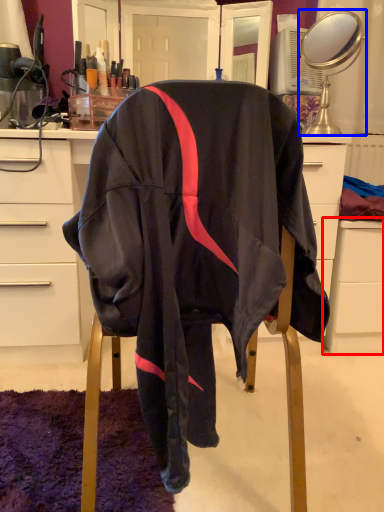
Question: Among these objects, which one is farthest to the camera, file cabinet (highlighted by a red box) or mirror (highlighted by a blue box)?

Choices:
 (A) file cabinet
 (B) mirror

Answer: (A)